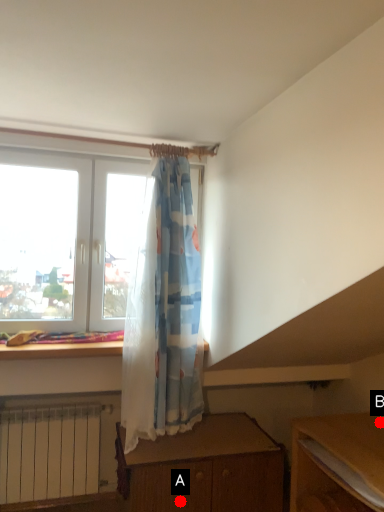
Question: Two points are circled on the image, labeled by A and B beside each circle. Which point is closer to the camera?

Choices:
 (A) A is closer
 (B) B is closer

Answer: (A)